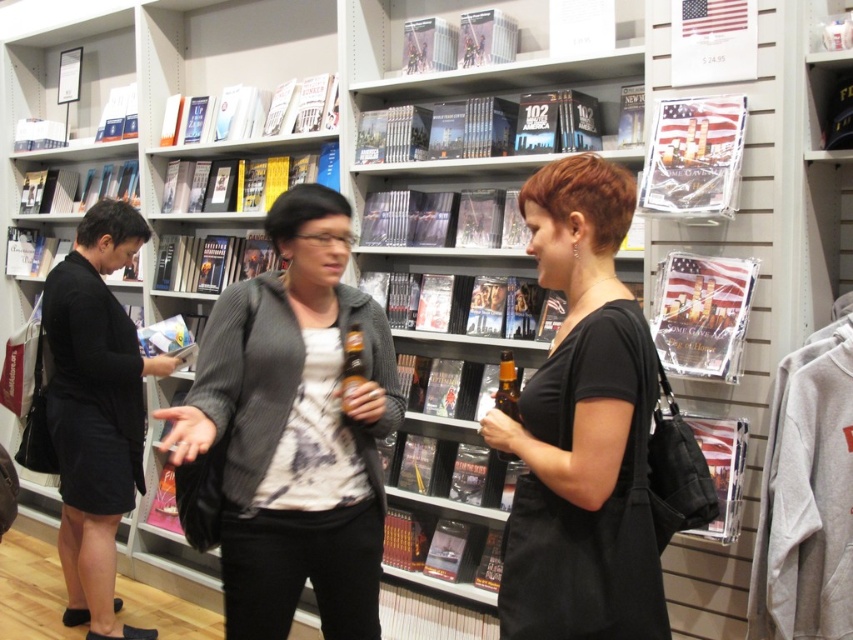
Who is lower down, gray textured jacket at center or black matte shirt at center?

gray textured jacket at center

Which of these two, gray textured jacket at center or black matte shirt at center, stands shorter?

With less height is black matte shirt at center.

Is point (316, 349) in front of point (618, 211)?

That is False.

The height and width of the screenshot is (640, 853). Find the location of `gray textured jacket at center`. gray textured jacket at center is located at coordinates (294, 429).

Who is more forward, (514, 592) or (114, 636)?

Point (514, 592) is in front.

Is point (651, 372) closer to camera compared to point (62, 300)?

Yes, point (651, 372) is in front of point (62, 300).

At what (x,y) coordinates should I click in order to perform the action: click on black matte shirt at center. Please return your answer as a coordinate pair (x, y). Looking at the image, I should click on (582, 428).

Which is behind, point (242, 589) or point (119, 502)?

Positioned behind is point (119, 502).

Between gray textured jacket at center and black matte dress at left, which one appears on the right side from the viewer's perspective?

gray textured jacket at center

Is point (265, 387) positioned before point (68, 524)?

Yes.

Locate an element on the screen. gray textured jacket at center is located at coordinates (294, 429).